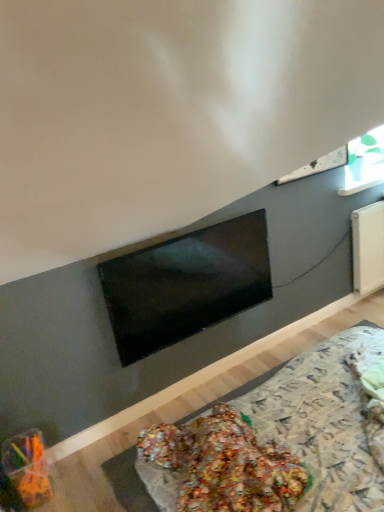
Measure the distance between translucent plastic container at lower left and camera.

1.72 meters.

The image size is (384, 512). Describe the element at coordinates (27, 468) in the screenshot. I see `translucent plastic container at lower left` at that location.

Locate an element on the screen. The height and width of the screenshot is (512, 384). matte black tv at center is located at coordinates (186, 284).

From a real-world perspective, which is physically below, transparent glass window at upper right or matte black tv at center?

In real-world perspective, matte black tv at center is lower.

Is point (358, 151) farther from camera compared to point (214, 232)?

Yes, it is behind point (214, 232).

Would you say transparent glass window at upper right is outside matte black tv at center?

Yes, transparent glass window at upper right is located beyond the bounds of matte black tv at center.

Which of these two, matte black tv at center or transparent glass window at upper right, is smaller?

Smaller between the two is transparent glass window at upper right.

At what (x,y) coordinates should I click in order to perform the action: click on window above the matte black tv at center (from a real-world perspective). Please return your answer as a coordinate pair (x, y). This screenshot has height=512, width=384. Looking at the image, I should click on (365, 163).

From a real-world perspective, is matte black tv at center under transparent glass window at upper right?

Indeed, from a real-world perspective, matte black tv at center is positioned beneath transparent glass window at upper right.

Image resolution: width=384 pixels, height=512 pixels. In order to click on window on the right of translucent plastic container at lower left in this screenshot , I will do `click(365, 163)`.

Does transparent glass window at upper right have a lesser width compared to translucent plastic container at lower left?

Correct, the width of transparent glass window at upper right is less than that of translucent plastic container at lower left.

Is matte black tv at center aimed at translucent plastic container at lower left?

No, matte black tv at center does not turn towards translucent plastic container at lower left.

From a real-world perspective, between matte black tv at center and translucent plastic container at lower left, who is vertically lower?

In real-world perspective, translucent plastic container at lower left is lower.

Does point (180, 241) come farther from viewer compared to point (44, 497)?

Yes, point (180, 241) is behind point (44, 497).

In the scene shown: Between matte black tv at center and translucent plastic container at lower left, which one is positioned behind?

matte black tv at center is further away from the camera.

Is translucent plastic container at lower left oriented towards matte black tv at center?

No, translucent plastic container at lower left is not turned towards matte black tv at center.

From the image's perspective, between translucent plastic container at lower left and matte black tv at center, who is located below?

translucent plastic container at lower left is shown below in the image.

Between translucent plastic container at lower left and matte black tv at center, which one is positioned behind?

matte black tv at center is further away from the camera.

Is translucent plastic container at lower left next to transparent glass window at upper right?

No, translucent plastic container at lower left is not with transparent glass window at upper right.

From the image's perspective, which one is positioned lower, translucent plastic container at lower left or transparent glass window at upper right?

From the image's view, translucent plastic container at lower left is below.

Which of these two, translucent plastic container at lower left or transparent glass window at upper right, stands shorter?

translucent plastic container at lower left.

The height and width of the screenshot is (512, 384). I want to click on window located on the right of matte black tv at center, so click(x=365, y=163).

The width and height of the screenshot is (384, 512). What are the coordinates of `window lying above the matte black tv at center (from the image's perspective)` in the screenshot? It's located at (365, 163).

Which object lies further to the anchor point transparent glass window at upper right, translucent plastic container at lower left or matte black tv at center?

translucent plastic container at lower left lies further to transparent glass window at upper right than the other object.

Estimate the real-world distances between objects in this image. Which object is closer to transparent glass window at upper right, matte black tv at center or translucent plastic container at lower left?

matte black tv at center lies closer to transparent glass window at upper right than the other object.

When comparing their distances from matte black tv at center, does transparent glass window at upper right or translucent plastic container at lower left seem further?

Among the two, transparent glass window at upper right is located further to matte black tv at center.

Looking at this image, estimate the real-world distances between objects in this image. Which object is closer to translucent plastic container at lower left, matte black tv at center or transparent glass window at upper right?

matte black tv at center is closer to translucent plastic container at lower left.

Estimate the real-world distances between objects in this image. Which object is closer to matte black tv at center, translucent plastic container at lower left or transparent glass window at upper right?

translucent plastic container at lower left lies closer to matte black tv at center than the other object.

Based on their spatial positions, is transparent glass window at upper right or matte black tv at center further from translucent plastic container at lower left?

transparent glass window at upper right is positioned further to the anchor translucent plastic container at lower left.

Identify the location of television between translucent plastic container at lower left and transparent glass window at upper right in the horizontal direction. (186, 284).